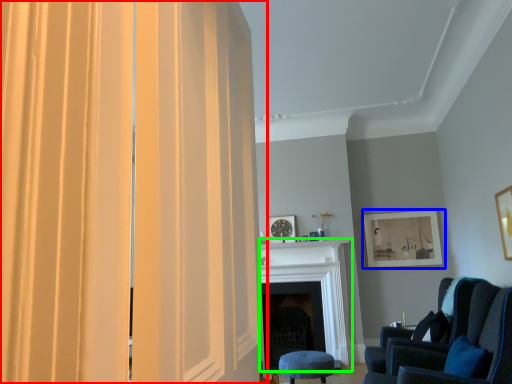
Question: Based on their relative distances, which object is farther from curtain (highlighted by a red box)? Choose from picture frame (highlighted by a blue box) and fireplace (highlighted by a green box).

Choices:
 (A) picture frame
 (B) fireplace

Answer: (A)